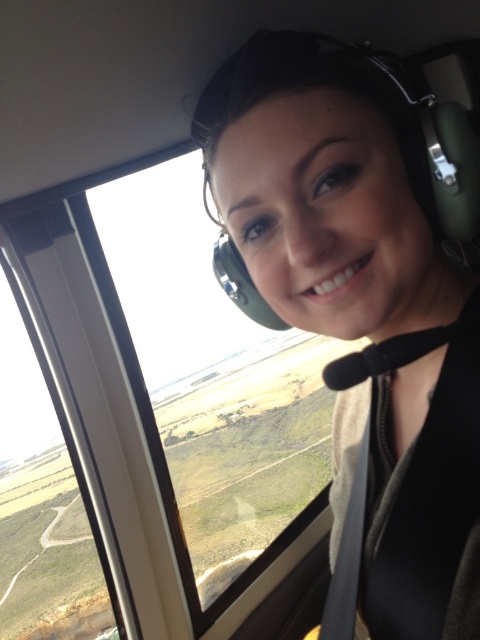
Question: Which object is farther from the camera taking this photo?

Choices:
 (A) transparent glass airplane window at center
 (B) matte green headset at center

Answer: (A)

Question: Which point is farther to the camera?

Choices:
 (A) (420, 566)
 (B) (248, 362)

Answer: (B)

Question: Can you confirm if matte green headset at center is wider than transparent glass airplane window at center?

Choices:
 (A) no
 (B) yes

Answer: (A)

Question: From the image, what is the correct spatial relationship of matte green headset at center in relation to transparent glass airplane window at center?

Choices:
 (A) right
 (B) left

Answer: (A)

Question: Does matte green headset at center appear over transparent glass airplane window at center?

Choices:
 (A) yes
 (B) no

Answer: (A)